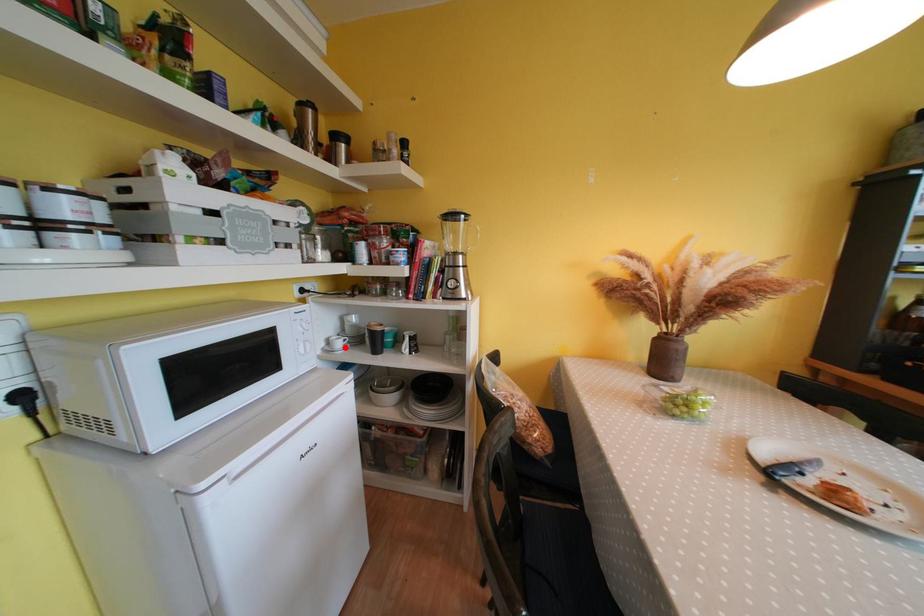
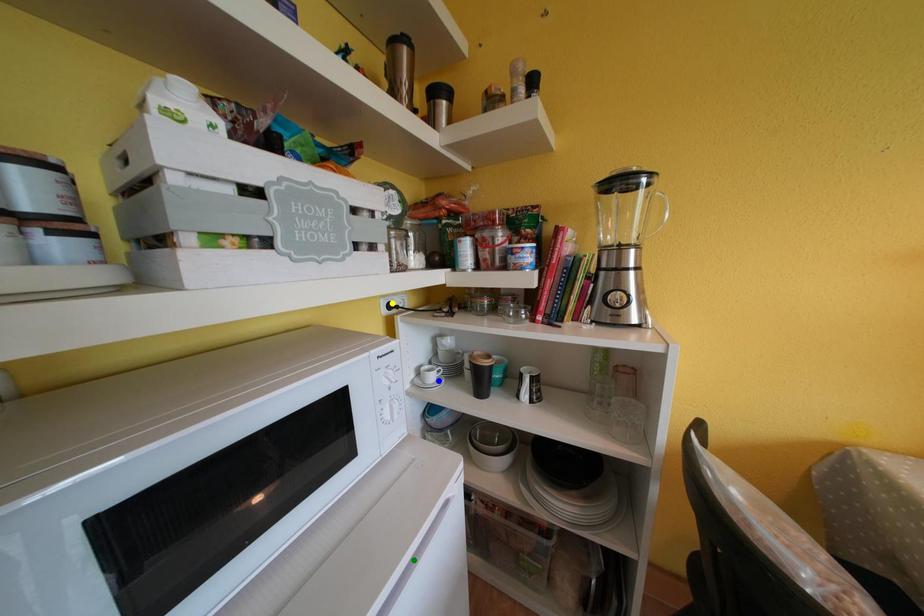
Question: I am providing you with two images of the same scene from different viewpoints. A red point is marked on the first image. You are given multiple points on the second image. Which spot in image 2 lines up with the point in image 1?

Choices:
 (A) green point
 (B) blue point
 (C) yellow point

Answer: (B)